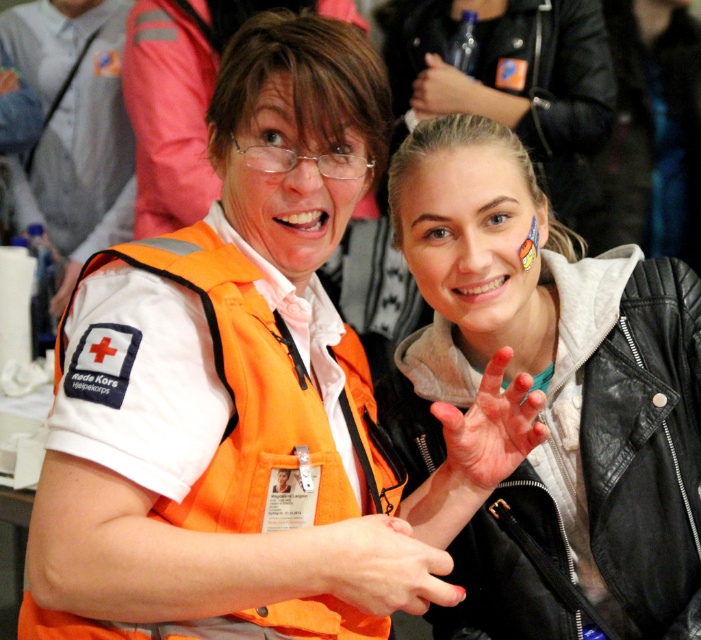
Looking at this image, can you confirm if leather jacket at right is positioned below orange matte hand at center?

Incorrect, leather jacket at right is not positioned below orange matte hand at center.

From the picture: Can you confirm if leather jacket at right is thinner than orange matte hand at center?

No, leather jacket at right is not thinner than orange matte hand at center.

Is point (557, 410) farther from camera compared to point (408, 611)?

Yes.

Locate an element on the screen. Image resolution: width=701 pixels, height=640 pixels. leather jacket at right is located at coordinates click(550, 396).

Is orange reflective vest at center wider than matte orange vest at center?

Yes, orange reflective vest at center is wider than matte orange vest at center.

Between point (36, 145) and point (54, 305), which one is positioned in front?

Point (54, 305) is more forward.

Locate an element on the screen. orange reflective vest at center is located at coordinates (74, 122).

Does point (496, 280) lie in front of point (491, 422)?

No.

The width and height of the screenshot is (701, 640). In order to click on leather jacket at right in this screenshot , I will do `click(550, 396)`.